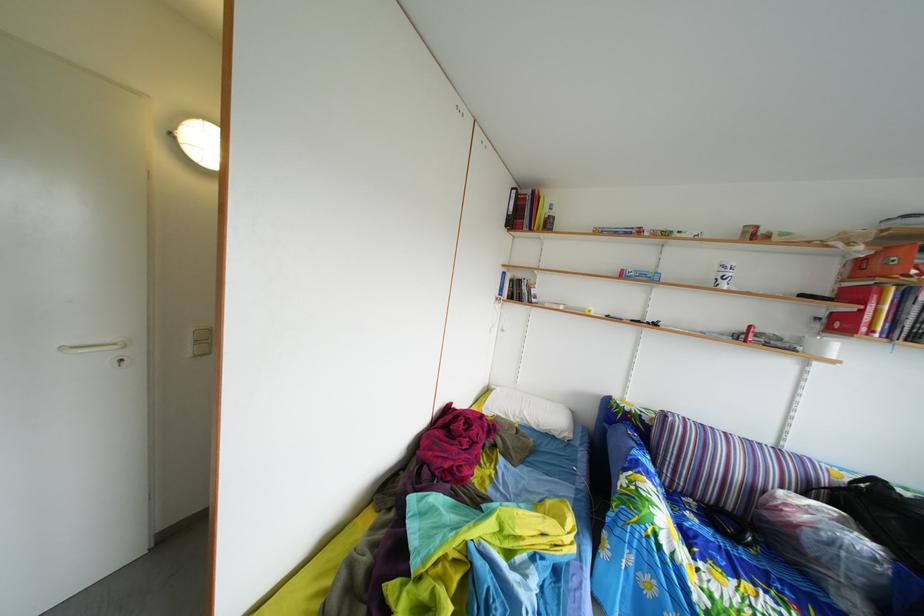
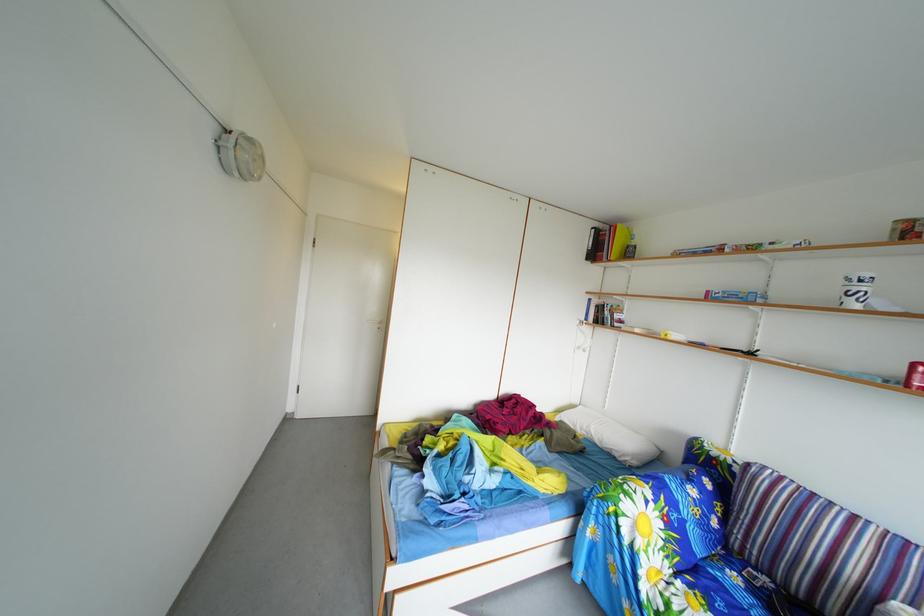
Find the pixel in the second image that matches pixel 699 524 in the first image.

(746, 585)